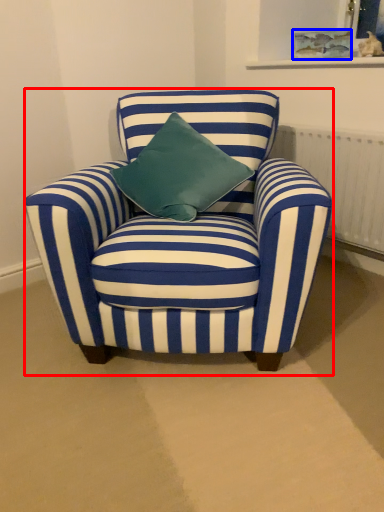
Question: Which point is further to the camera, chair (highlighted by a red box) or picture frame (highlighted by a blue box)?

Choices:
 (A) chair
 (B) picture frame

Answer: (B)